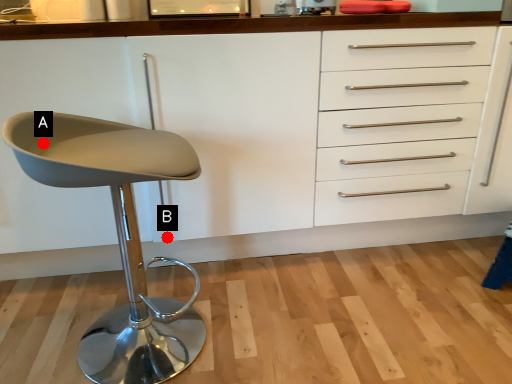
Question: Two points are circled on the image, labeled by A and B beside each circle. Which of the following is the closest to the observer?

Choices:
 (A) A is closer
 (B) B is closer

Answer: (A)